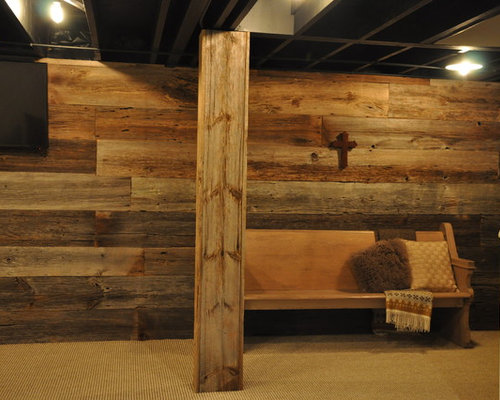
Locate an element on the screen. This screenshot has width=500, height=400. blanket is located at coordinates coord(412,301).